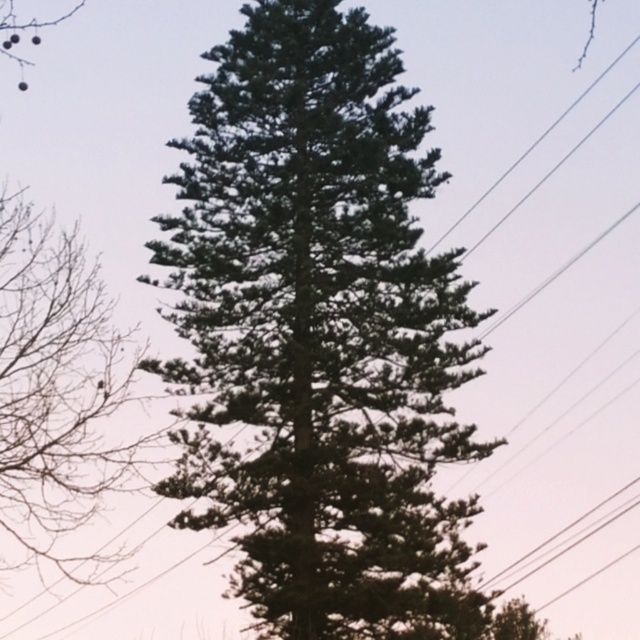
Does green needle-like tree at center have a greater height compared to green needle-like at center?

Yes.

Does green needle-like tree at center appear on the right side of green needle-like at center?

Correct, you'll find green needle-like tree at center to the right of green needle-like at center.

Which is in front, point (364, 330) or point (26, 65)?

Point (364, 330) is in front.

Where is `green needle-like tree at center`? green needle-like tree at center is located at coordinates (320, 332).

Which of these two, green needle-like at center or clear wire at upper right, stands shorter?

With less height is clear wire at upper right.

Can you confirm if green needle-like at center is wider than clear wire at upper right?

Yes.

Who is more forward, (45, 490) or (497, 180)?

Point (45, 490) is more forward.

Locate an element on the screen. green needle-like at center is located at coordinates (56, 388).

Is point (328, 506) in front of point (568, 104)?

Yes, it is in front of point (568, 104).

Find the location of a particular element. The height and width of the screenshot is (640, 640). green needle-like tree at center is located at coordinates (320, 332).